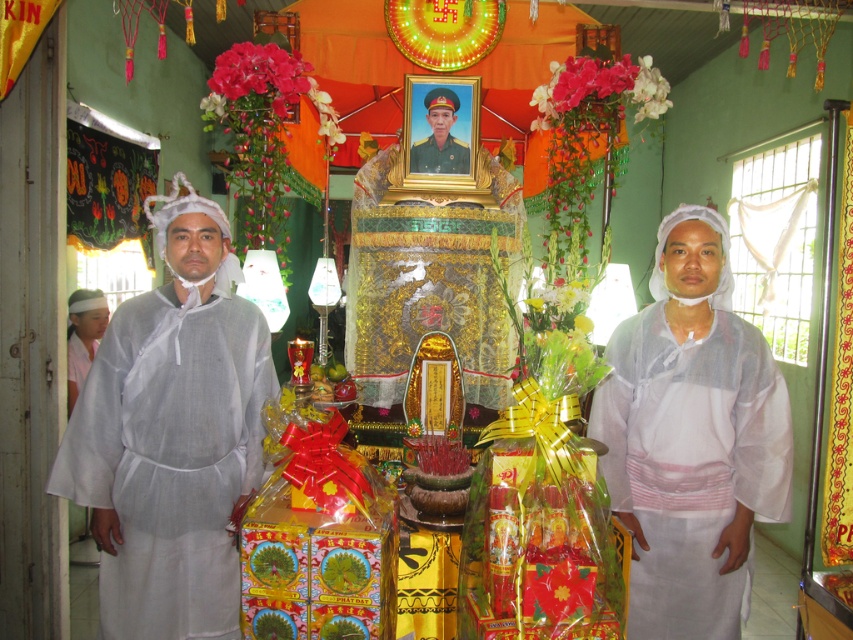
Question: Does white sheer robe at right appear on the right side of white clothed man at center?

Choices:
 (A) no
 (B) yes

Answer: (B)

Question: Which point is closer to the camera?

Choices:
 (A) (247, 428)
 (B) (444, 152)
 (C) (740, 381)
 (D) (451, 112)

Answer: (C)

Question: Does white linen robe at center have a lesser width compared to green matte uniform at center?

Choices:
 (A) no
 (B) yes

Answer: (A)

Question: Does white sheer robe at right have a smaller size compared to white clothed man at center?

Choices:
 (A) no
 (B) yes

Answer: (A)

Question: Considering the real-world distances, which object is farthest from the white clothed man at center?

Choices:
 (A) white sheer robe at right
 (B) white linen robe at center
 (C) green matte uniform at center

Answer: (A)

Question: Which object is positioned farthest from the white clothed man at center?

Choices:
 (A) white sheer robe at right
 (B) green matte uniform at center
 (C) white linen robe at center

Answer: (A)